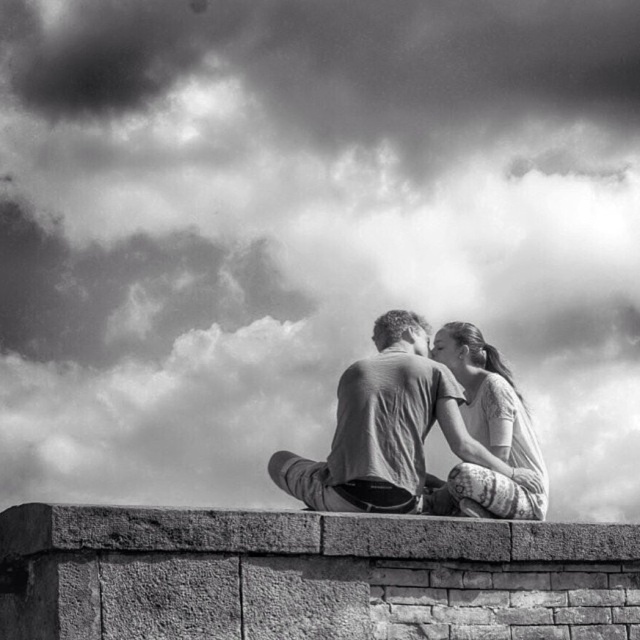
Question: Does brick at center have a lesser width compared to patterned fabric dress at center?

Choices:
 (A) no
 (B) yes

Answer: (A)

Question: Can you confirm if brick at center is smaller than patterned fabric dress at center?

Choices:
 (A) yes
 (B) no

Answer: (B)

Question: Which object appears farthest from the camera in this image?

Choices:
 (A) patterned fabric dress at center
 (B) matte gray couple at center

Answer: (B)

Question: Based on their relative distances, which object is nearer to the matte gray couple at center?

Choices:
 (A) patterned fabric dress at center
 (B) brick at center

Answer: (A)

Question: Which object is the farthest from the brick at center?

Choices:
 (A) matte gray couple at center
 (B) patterned fabric dress at center

Answer: (B)

Question: Does matte gray couple at center appear on the right side of patterned fabric dress at center?

Choices:
 (A) no
 (B) yes

Answer: (A)